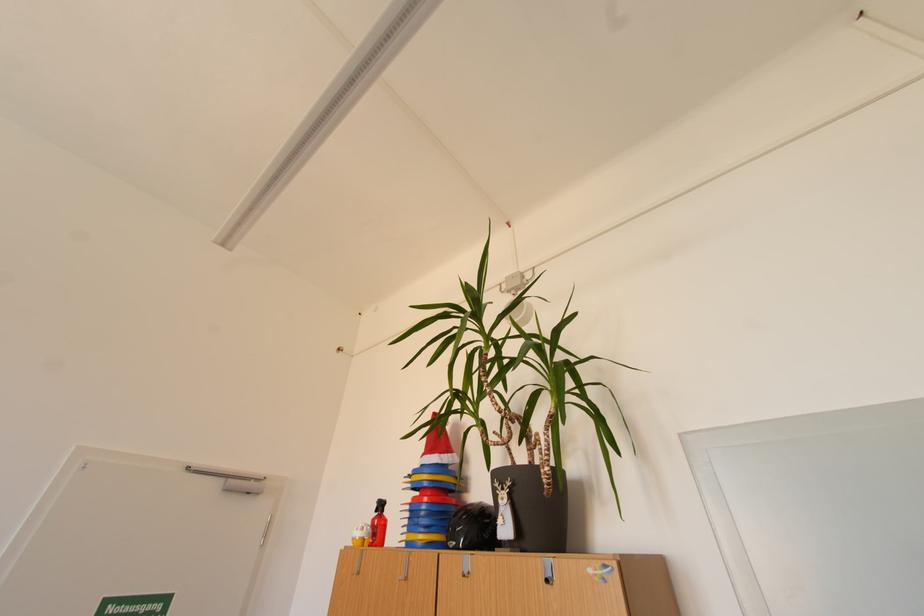
Find where to lift the black helmet. Please return your answer as a coordinate pair (x, y).

(472, 528)